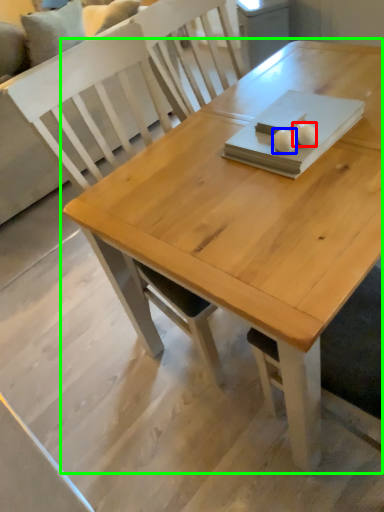
Question: Which object is positioned closest to food (highlighted by a red box)? Select from food (highlighted by a blue box) and table (highlighted by a green box).

Choices:
 (A) food
 (B) table

Answer: (A)